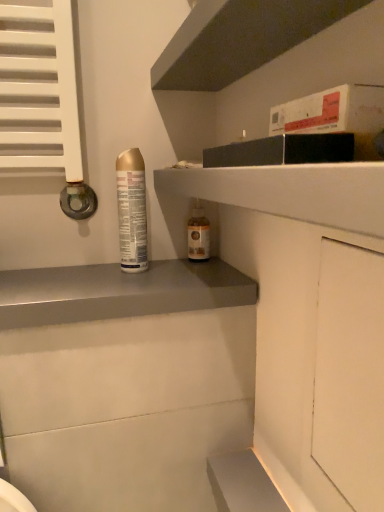
At what (x,y) coordinates should I click in order to perform the action: click on vacant space positioned to the left of translucent glass bottle at center, which is the first bottle from right to left. Please return your answer as a coordinate pair (x, y). This screenshot has height=512, width=384. Looking at the image, I should click on pos(122,268).